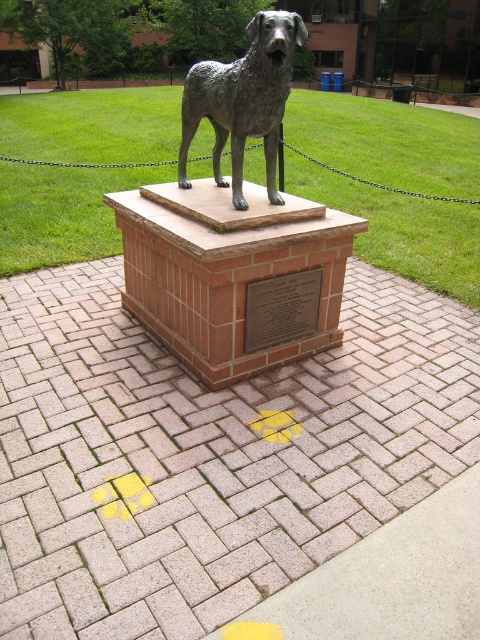
Who is taller, bronze statue of a dog at center or bronze plaque at center?

bronze statue of a dog at center

From the picture: Is bronze statue of a dog at center wider than bronze plaque at center?

Indeed, bronze statue of a dog at center has a greater width compared to bronze plaque at center.

Measure the distance between bronze statue of a dog at center and camera.

The distance of bronze statue of a dog at center from camera is 9.12 feet.

The image size is (480, 640). Find the location of `bronze statue of a dog at center`. bronze statue of a dog at center is located at coordinates (243, 99).